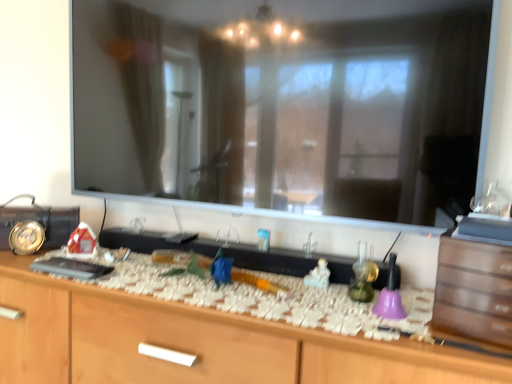
This screenshot has width=512, height=384. What are the coordinates of `wooden cabinet at center` in the screenshot? It's located at (196, 343).

The image size is (512, 384). What do you see at coordinates (196, 343) in the screenshot?
I see `wooden cabinet at center` at bounding box center [196, 343].

Describe the element at coordinates (474, 290) in the screenshot. This screenshot has width=512, height=384. I see `brown wooden drawer at right` at that location.

Where is `brown wooden drawer at right`? Image resolution: width=512 pixels, height=384 pixels. brown wooden drawer at right is located at coordinates (474, 290).

I want to click on wooden cabinet at center, so (x=196, y=343).

Can you confirm if wooden cabinet at center is positioned to the left of brown wooden drawer at right?

Indeed, wooden cabinet at center is positioned on the left side of brown wooden drawer at right.

Is wooden cabinet at center positioned in front of brown wooden drawer at right?

Yes, the depth of wooden cabinet at center is less than that of brown wooden drawer at right.

Does point (335, 344) appear closer or farther from the camera than point (507, 294)?

Clearly, point (335, 344) is more distant from the camera than point (507, 294).

From the image's perspective, between wooden cabinet at center and brown wooden drawer at right, which one is located above?

From the image's view, brown wooden drawer at right is above.

From a real-world perspective, which object stands above the other?

brown wooden drawer at right is physically above.

Looking at their sizes, would you say wooden cabinet at center is wider or thinner than brown wooden drawer at right?

Considering their sizes, wooden cabinet at center looks broader than brown wooden drawer at right.

Considering the sizes of objects wooden cabinet at center and brown wooden drawer at right in the image provided, who is shorter, wooden cabinet at center or brown wooden drawer at right?

brown wooden drawer at right is shorter.

Is wooden cabinet at center bigger or smaller than brown wooden drawer at right?

Clearly, wooden cabinet at center is larger in size than brown wooden drawer at right.

From the picture: Is wooden cabinet at center located outside brown wooden drawer at right?

Yes, wooden cabinet at center is not within brown wooden drawer at right.

Is wooden cabinet at center far from brown wooden drawer at right?

wooden cabinet at center is actually quite close to brown wooden drawer at right.

Is wooden cabinet at center facing towards brown wooden drawer at right?

No.

What's the angular difference between wooden cabinet at center and brown wooden drawer at right's facing directions?

They differ by 11.2 degrees in their facing directions.

You are a GUI agent. You are given a task and a screenshot of the screen. Output one action in this format:
    pyautogui.click(x=<x>, y=<y>)
    Task: Click on the cabinetry in front of the brown wooden drawer at right
    This screenshot has width=512, height=384.
    Given the screenshot: What is the action you would take?
    pyautogui.click(x=196, y=343)

Can you confirm if brown wooden drawer at right is positioned to the right of wooden cabinet at center?

Correct, you'll find brown wooden drawer at right to the right of wooden cabinet at center.

Between brown wooden drawer at right and wooden cabinet at center, which one is positioned behind?

Positioned behind is brown wooden drawer at right.

Considering the points (436, 283) and (72, 339), which point is in front, point (436, 283) or point (72, 339)?

Point (436, 283)

From the image's perspective, which is below, brown wooden drawer at right or wooden cabinet at center?

wooden cabinet at center is shown below in the image.

From a real-world perspective, is brown wooden drawer at right on top of wooden cabinet at center?

Indeed, from a real-world perspective, brown wooden drawer at right stands above wooden cabinet at center.

Does brown wooden drawer at right have a greater width compared to wooden cabinet at center?

In fact, brown wooden drawer at right might be narrower than wooden cabinet at center.

Which of these two, brown wooden drawer at right or wooden cabinet at center, stands shorter?

brown wooden drawer at right is shorter.

Which of these two, brown wooden drawer at right or wooden cabinet at center, is bigger?

wooden cabinet at center is bigger.

Would you say brown wooden drawer at right is inside or outside wooden cabinet at center?

→ brown wooden drawer at right exists outside the volume of wooden cabinet at center.

Is brown wooden drawer at right next to wooden cabinet at center?

There is a gap between brown wooden drawer at right and wooden cabinet at center.

Could you tell me if brown wooden drawer at right is turned towards wooden cabinet at center?

No, brown wooden drawer at right is not oriented towards wooden cabinet at center.

How many degrees apart are the facing directions of brown wooden drawer at right and wooden cabinet at center?

11.2 degrees.

Find the location of a particular element. Image resolution: width=512 pixels, height=384 pixels. drawer above the wooden cabinet at center (from the image's perspective) is located at coordinates (474, 290).

Where is `cabinetry below the brown wooden drawer at right (from a real-world perspective)`? This screenshot has height=384, width=512. cabinetry below the brown wooden drawer at right (from a real-world perspective) is located at coordinates (196, 343).

The height and width of the screenshot is (384, 512). Find the location of `drawer above the wooden cabinet at center (from the image's perspective)`. drawer above the wooden cabinet at center (from the image's perspective) is located at coordinates (474, 290).